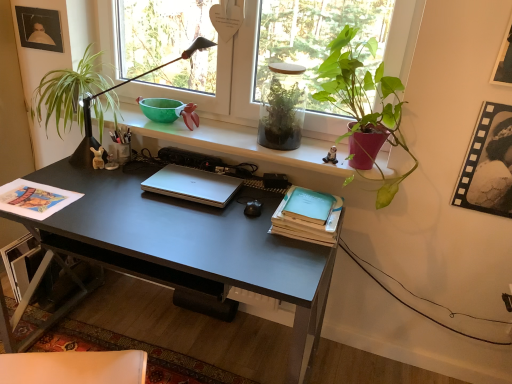
Question: Is matte black desk at center wider than translucent glass terrarium at center, which is counted as the 2th houseplant, starting from the right?

Choices:
 (A) yes
 (B) no

Answer: (A)

Question: Is matte black desk at center outside translucent glass terrarium at center, which ranks as the second houseplant in left-to-right order?

Choices:
 (A) yes
 (B) no

Answer: (A)

Question: Is translucent glass terrarium at center, which is counted as the 2th houseplant, starting from the right, at the back of matte black desk at center?

Choices:
 (A) yes
 (B) no

Answer: (B)

Question: Is matte black desk at center positioned in front of translucent glass terrarium at center, which ranks as the second houseplant in left-to-right order?

Choices:
 (A) no
 (B) yes

Answer: (B)

Question: Considering the relative sizes of matte black desk at center and translucent glass terrarium at center, which is counted as the 2th houseplant, starting from the right, in the image provided, is matte black desk at center bigger than translucent glass terrarium at center, which is counted as the 2th houseplant, starting from the right,?

Choices:
 (A) yes
 (B) no

Answer: (A)

Question: Considering the relative positions of translucent glass terrarium at center, which is counted as the 2th houseplant, starting from the right, and green leafy plant at left, the 1th houseplant positioned from the left, in the image provided, is translucent glass terrarium at center, which is counted as the 2th houseplant, starting from the right, to the left or to the right of green leafy plant at left, the 1th houseplant positioned from the left,?

Choices:
 (A) right
 (B) left

Answer: (A)

Question: From their relative heights in the image, would you say translucent glass terrarium at center, which ranks as the second houseplant in left-to-right order, is taller or shorter than green leafy plant at left, which is the 3th houseplant from right to left?

Choices:
 (A) tall
 (B) short

Answer: (B)

Question: From a real-world perspective, relative to green leafy plant at left, which is the 3th houseplant from right to left, is translucent glass terrarium at center, which is counted as the 2th houseplant, starting from the right, vertically above or below?

Choices:
 (A) below
 (B) above

Answer: (B)

Question: Based on their sizes in the image, would you say translucent glass terrarium at center, which ranks as the second houseplant in left-to-right order, is bigger or smaller than green leafy plant at left, which is the 3th houseplant from right to left?

Choices:
 (A) big
 (B) small

Answer: (B)

Question: In the image, is green leafy plant at left, which is the 3th houseplant from right to left, on the left side or the right side of teal matte paperback book at right, the 2th paperback book ordered from the bottom?

Choices:
 (A) left
 (B) right

Answer: (A)

Question: From the image's perspective, is green leafy plant at left, which is the 3th houseplant from right to left, positioned above or below teal matte paperback book at right, the first paperback book when ordered from top to bottom?

Choices:
 (A) above
 (B) below

Answer: (A)

Question: Based on their sizes in the image, would you say green leafy plant at left, which is the 3th houseplant from right to left, is bigger or smaller than teal matte paperback book at right, the 2th paperback book ordered from the bottom?

Choices:
 (A) big
 (B) small

Answer: (A)

Question: Looking at their shapes, would you say green leafy plant at left, the 1th houseplant positioned from the left, is wider or thinner than teal matte paperback book at right, the first paperback book when ordered from top to bottom?

Choices:
 (A) thin
 (B) wide

Answer: (B)

Question: From the image's perspective, relative to translucent glass terrarium at center, which is counted as the 2th houseplant, starting from the right, is light blue matte paper at center right, the second paperback book when ordered from top to bottom, above or below?

Choices:
 (A) below
 (B) above

Answer: (A)

Question: In the image, is light blue matte paper at center right, the second paperback book when ordered from top to bottom, on the left side or the right side of translucent glass terrarium at center, which is counted as the 2th houseplant, starting from the right?

Choices:
 (A) left
 (B) right

Answer: (B)